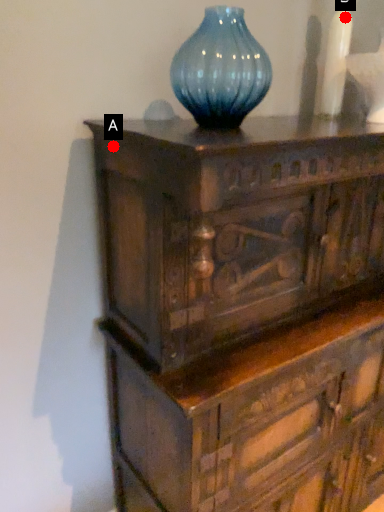
Question: Two points are circled on the image, labeled by A and B beside each circle. Which point is further to the camera?

Choices:
 (A) A is further
 (B) B is further

Answer: (B)